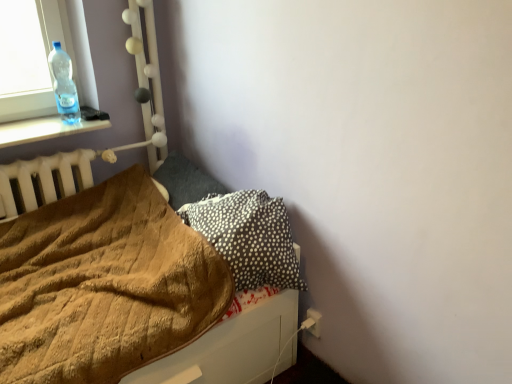
Question: From the image's perspective, would you say transparent plastic bottle at upper left is positioned over brown fuzzy blanket at lower left?

Choices:
 (A) no
 (B) yes

Answer: (B)

Question: Is there a large distance between transparent plastic bottle at upper left and brown fuzzy blanket at lower left?

Choices:
 (A) no
 (B) yes

Answer: (A)

Question: Is transparent plastic bottle at upper left smaller than brown fuzzy blanket at lower left?

Choices:
 (A) yes
 (B) no

Answer: (A)

Question: From a real-world perspective, does transparent plastic bottle at upper left sit lower than brown fuzzy blanket at lower left?

Choices:
 (A) no
 (B) yes

Answer: (A)

Question: Is transparent plastic bottle at upper left not inside brown fuzzy blanket at lower left?

Choices:
 (A) yes
 (B) no

Answer: (A)

Question: Considering the positions of black dotted pillow at lower right, acting as the 2th pillow starting from the back, and transparent plastic bottle at upper left in the image, is black dotted pillow at lower right, acting as the 2th pillow starting from the back, bigger or smaller than transparent plastic bottle at upper left?

Choices:
 (A) small
 (B) big

Answer: (B)

Question: Considering the positions of black dotted pillow at lower right, acting as the 2th pillow starting from the back, and transparent plastic bottle at upper left in the image, is black dotted pillow at lower right, acting as the 2th pillow starting from the back, wider or thinner than transparent plastic bottle at upper left?

Choices:
 (A) thin
 (B) wide

Answer: (B)

Question: From a real-world perspective, is black dotted pillow at lower right, marked as the 1th pillow in a front-to-back arrangement, physically located above or below transparent plastic bottle at upper left?

Choices:
 (A) above
 (B) below

Answer: (B)

Question: Based on their positions, is black dotted pillow at lower right, marked as the 1th pillow in a front-to-back arrangement, located to the left or right of transparent plastic bottle at upper left?

Choices:
 (A) right
 (B) left

Answer: (A)

Question: From their relative heights in the image, would you say brown fuzzy blanket at lower left is taller or shorter than transparent plastic bottle at upper left?

Choices:
 (A) tall
 (B) short

Answer: (B)

Question: Based on their sizes in the image, would you say brown fuzzy blanket at lower left is bigger or smaller than transparent plastic bottle at upper left?

Choices:
 (A) big
 (B) small

Answer: (A)

Question: Choose the correct answer: Is brown fuzzy blanket at lower left inside transparent plastic bottle at upper left or outside it?

Choices:
 (A) inside
 (B) outside

Answer: (B)

Question: From a real-world perspective, is brown fuzzy blanket at lower left positioned above or below transparent plastic bottle at upper left?

Choices:
 (A) below
 (B) above

Answer: (A)

Question: Is black dotted pillow at lower right, acting as the 2th pillow starting from the back, inside the boundaries of dark gray fabric pillow at center-left, placed as the 2th pillow when sorted from front to back, or outside?

Choices:
 (A) outside
 (B) inside

Answer: (A)

Question: From the image's perspective, is black dotted pillow at lower right, marked as the 1th pillow in a front-to-back arrangement, located above or below dark gray fabric pillow at center-left, placed as the 2th pillow when sorted from front to back?

Choices:
 (A) above
 (B) below

Answer: (B)